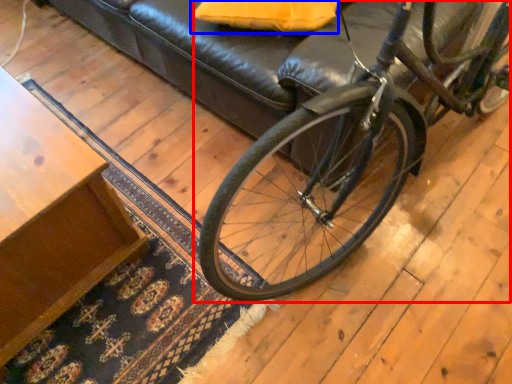
Question: Which point is closer to the camera, bicycle (highlighted by a red box) or pillow (highlighted by a blue box)?

Choices:
 (A) bicycle
 (B) pillow

Answer: (A)